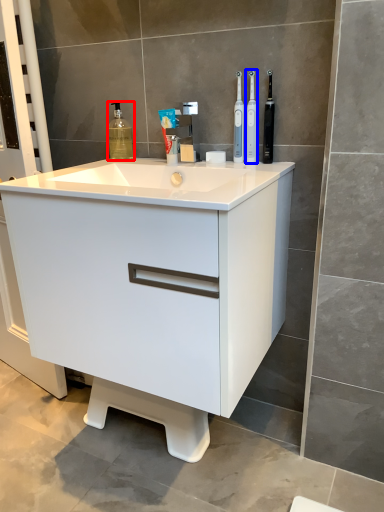
Question: Among these objects, which one is nearest to the camera, cleaning product (highlighted by a red box) or toothbrush (highlighted by a blue box)?

Choices:
 (A) cleaning product
 (B) toothbrush

Answer: (B)